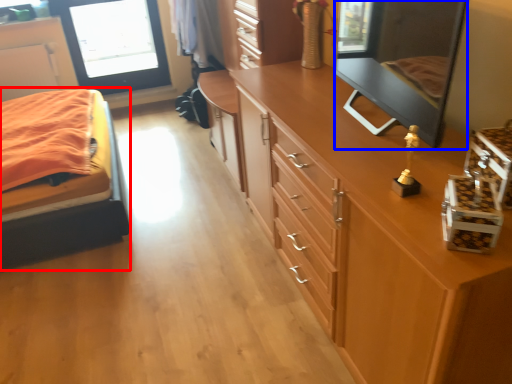
Question: Which object appears closest to the camera in this image, bed (highlighted by a red box) or mirror (highlighted by a blue box)?

Choices:
 (A) bed
 (B) mirror

Answer: (B)